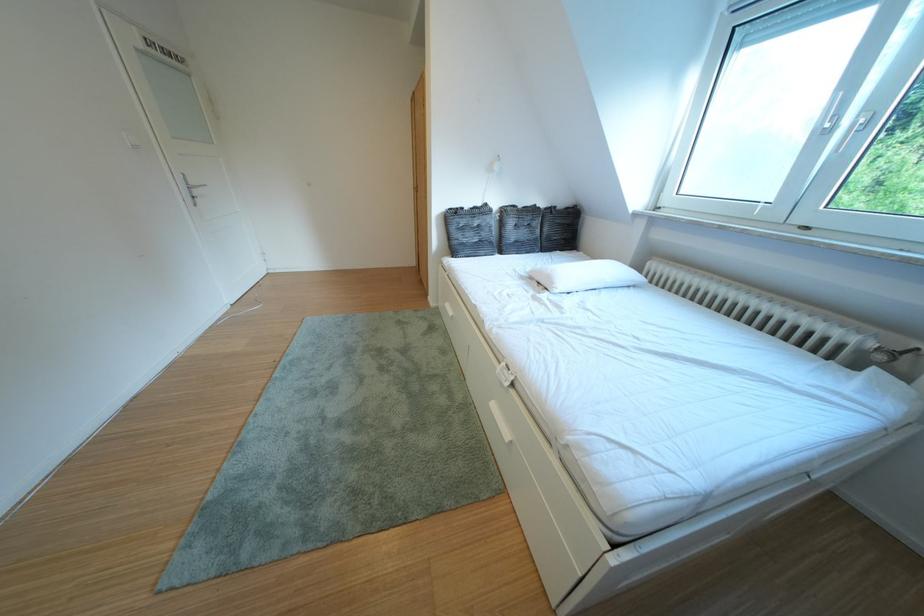
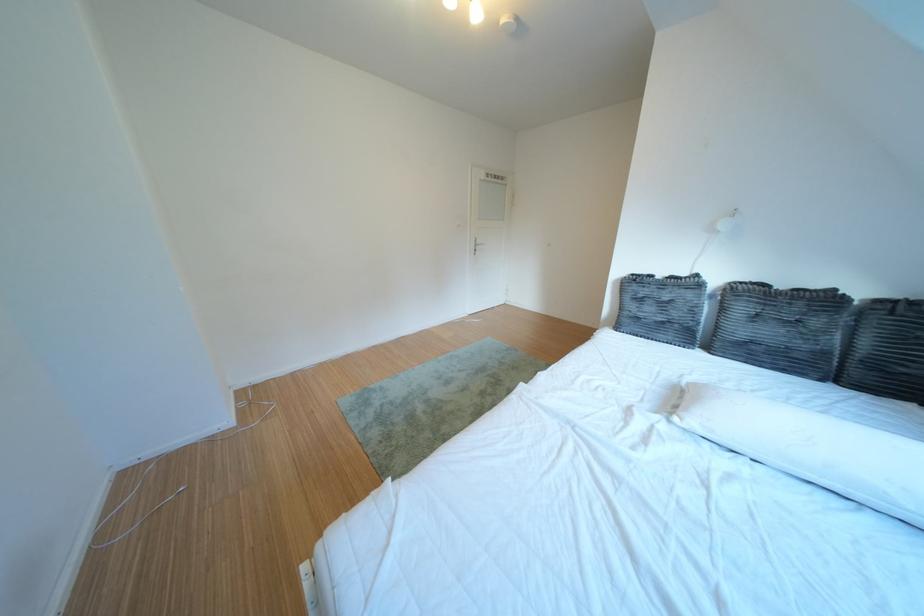
The point at (468, 246) is marked in the first image. Where is the corresponding point in the second image?

(639, 318)